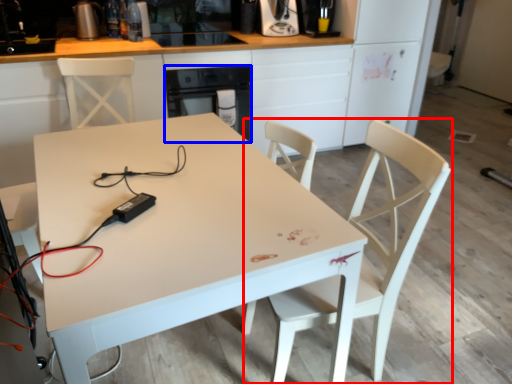
Question: Which object is further to the camera taking this photo, chair (highlighted by a red box) or oven (highlighted by a blue box)?

Choices:
 (A) chair
 (B) oven

Answer: (B)